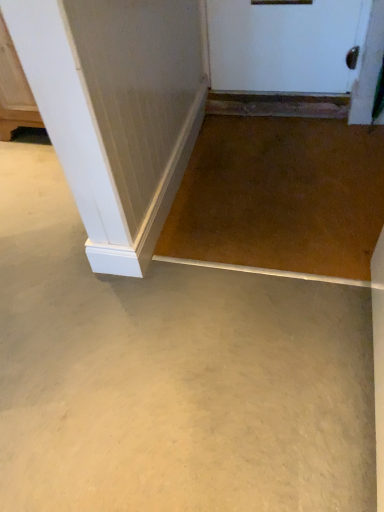
Identify the location of free point in front of clear glass screen door at upper right. (366, 153).